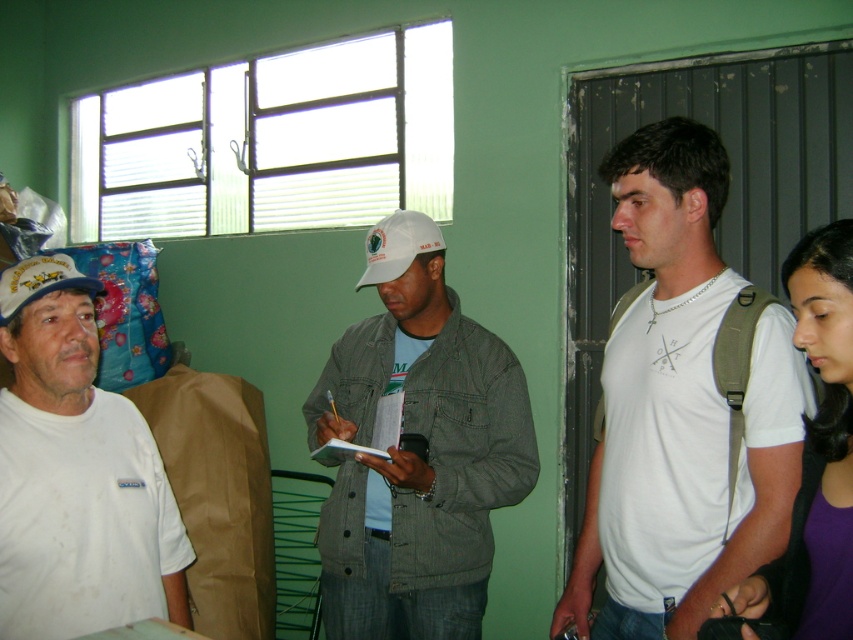
Which of these two, white matte baseball cap at center or white fabric baseball cap at left, stands taller?

white matte baseball cap at center

Describe the element at coordinates (397, 244) in the screenshot. I see `white matte baseball cap at center` at that location.

Locate an element on the screen. The width and height of the screenshot is (853, 640). white matte baseball cap at center is located at coordinates click(x=397, y=244).

Does white matte t-shirt at left have a lesser width compared to white fabric baseball cap at left?

No.

Can you confirm if white matte t-shirt at left is positioned to the right of white fabric baseball cap at left?

Indeed, white matte t-shirt at left is positioned on the right side of white fabric baseball cap at left.

Where is `white matte t-shirt at left`? white matte t-shirt at left is located at coordinates (76, 474).

Find the location of a particular element. Image resolution: width=853 pixels, height=640 pixels. white matte t-shirt at left is located at coordinates (76, 474).

Does white cotton t-shirt at right appear on the right side of white matte baseball cap at center?

Indeed, white cotton t-shirt at right is positioned on the right side of white matte baseball cap at center.

Looking at this image, who is more forward, (654, 424) or (392, 221)?

Point (654, 424) is in front.

Which is behind, point (693, 292) or point (390, 262)?

The point (390, 262) is more distant.

Find the location of `white cotton t-shirt at right`. white cotton t-shirt at right is located at coordinates (682, 408).